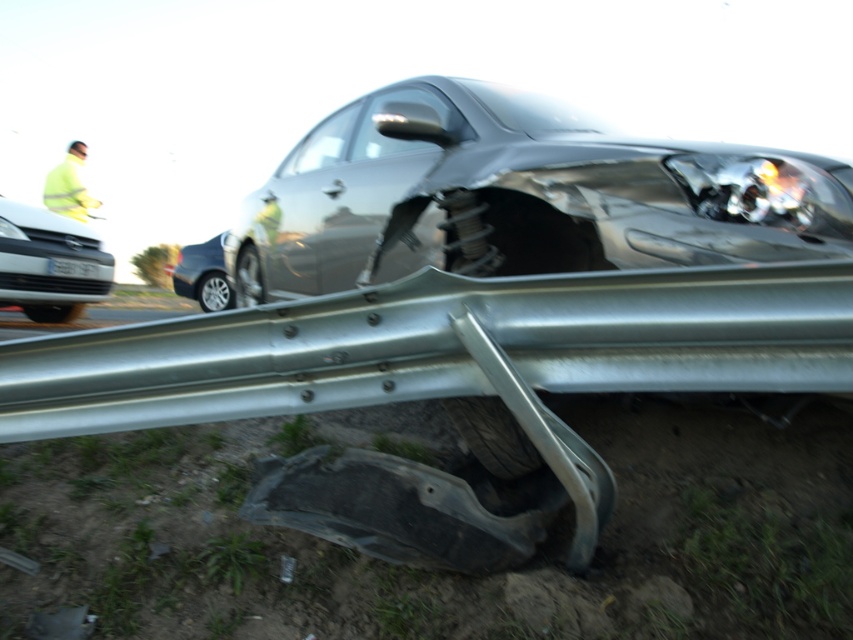
You are a traffic officer assessing the accident scene. The white glossy sedan at upper left is part of the incident. Based on its position, can you determine if it was involved in the collision with the guardrail?

The white glossy sedan at upper left is located at point (49, 262), which is far from the guardrail collision area, so it was not involved in the collision with the guardrail.

You are a traffic officer analyzing the accident scene. The white glossy sedan at upper left is a potential witness vehicle. Can you determine its exact location coordinates in the image?

The white glossy sedan at upper left is located at coordinates point (49, 262).